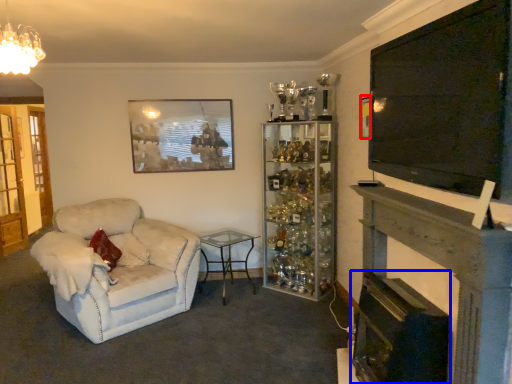
Question: Which object is further to the camera taking this photo, picture frame (highlighted by a red box) or fireplace (highlighted by a blue box)?

Choices:
 (A) picture frame
 (B) fireplace

Answer: (A)